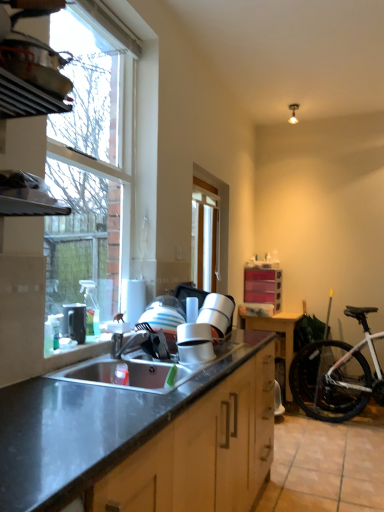
Question: From the image's perspective, is clear glass window at center, which is the second window from left to right, above or below matte black kettle at left?

Choices:
 (A) below
 (B) above

Answer: (B)

Question: From a real-world perspective, relative to matte black kettle at left, is clear glass window at center, which is the 1th window from right to left, vertically above or below?

Choices:
 (A) below
 (B) above

Answer: (B)

Question: Estimate the real-world distances between objects in this image. Which object is closer to the matte black kettle at left?

Choices:
 (A) clear glass window at upper left, which is the 2th window in right-to-left order
 (B) wooden table at right
 (C) dark gray granite countertop at center
 (D) stainless steel sink at lower center
 (E) white matte bicycle at lower right

Answer: (D)

Question: Considering the real-world distances, which object is closest to the stainless steel sink at lower center?

Choices:
 (A) white matte bicycle at lower right
 (B) clear glass window at center, which is the second window from left to right
 (C) brushed metal faucet at sink
 (D) wooden table at right
 (E) dark gray granite countertop at center

Answer: (C)